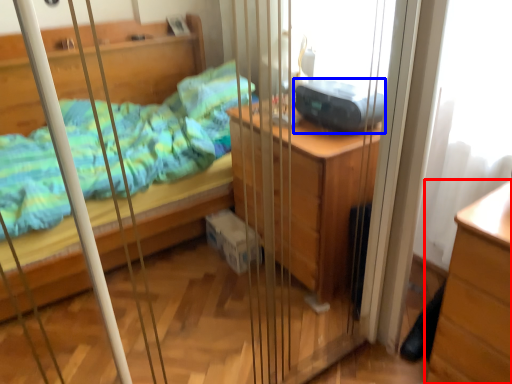
Question: Among these objects, which one is farthest to the camera, chest of drawers (highlighted by a red box) or equipment (highlighted by a blue box)?

Choices:
 (A) chest of drawers
 (B) equipment

Answer: (B)